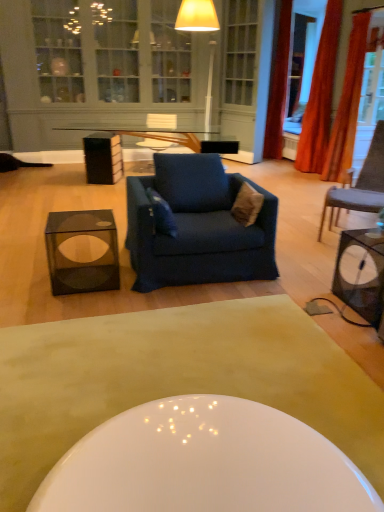
Find the location of a particular element. The image size is (384, 512). vacant space to the left of transparent glass cube at lower left, which is the 1th table in left-to-right order is located at coordinates (22, 282).